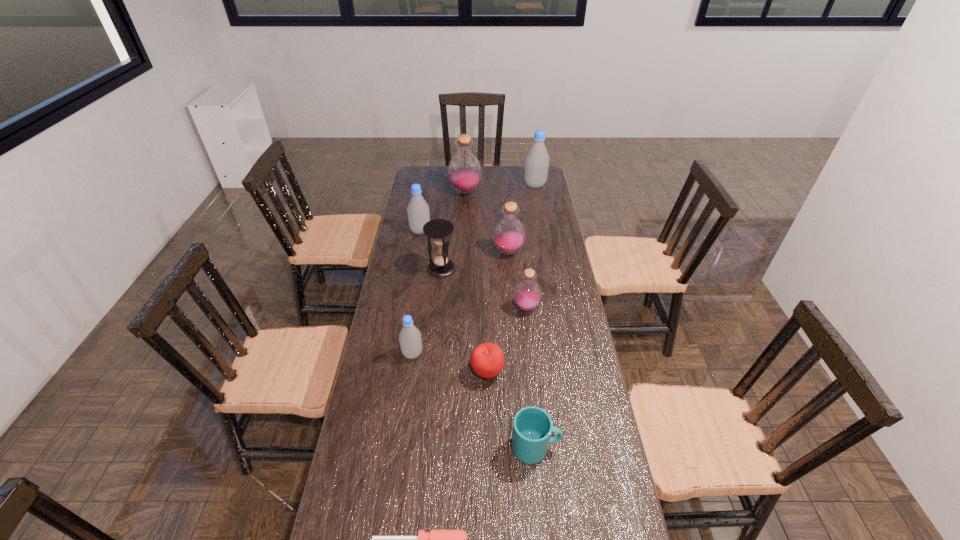
I want to click on vacant space at the far right corner of the desktop, so pyautogui.click(x=524, y=186).

In order to click on vacant space that is in between the third nearest bottle and the cup in this screenshot , I will do `click(522, 349)`.

I want to click on vacant space that is in between the cup and the leftmost purple bottle, so click(x=500, y=320).

Where is `free spot between the third farthest bottle and the sixth farthest object`? The width and height of the screenshot is (960, 540). free spot between the third farthest bottle and the sixth farthest object is located at coordinates (473, 269).

Find the location of a particular element. The height and width of the screenshot is (540, 960). vacant space in between the third bottle from left to right and the rightmost bottle is located at coordinates (500, 188).

In order to click on vacant space that's between the sixth farthest object and the cup in this screenshot , I will do `click(531, 377)`.

Where is `vacant area that lies between the rightmost object and the red apple`? The width and height of the screenshot is (960, 540). vacant area that lies between the rightmost object and the red apple is located at coordinates (511, 279).

Identify which object is the nearest to the nearest bottle. Please provide its 2D coordinates. Your answer should be formatted as a tuple, i.e. [(x, y)], where the tuple contains the x and y coordinates of a point satisfying the conditions above.

[(487, 360)]

Where is `object identified as the ninth closest to the farthest purple bottle`? Image resolution: width=960 pixels, height=540 pixels. object identified as the ninth closest to the farthest purple bottle is located at coordinates (434, 539).

Identify which bottle is the third nearest to the hourglass. Please provide its 2D coordinates. Your answer should be formatted as a tuple, i.e. [(x, y)], where the tuple contains the x and y coordinates of a point satisfying the conditions above.

[(527, 295)]